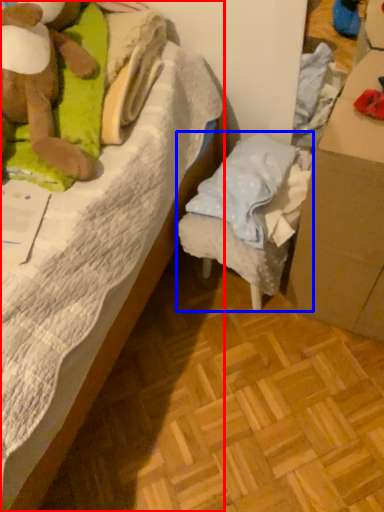
Question: Which point is closer to the camera, bed (highlighted by a red box) or furniture (highlighted by a blue box)?

Choices:
 (A) bed
 (B) furniture

Answer: (A)